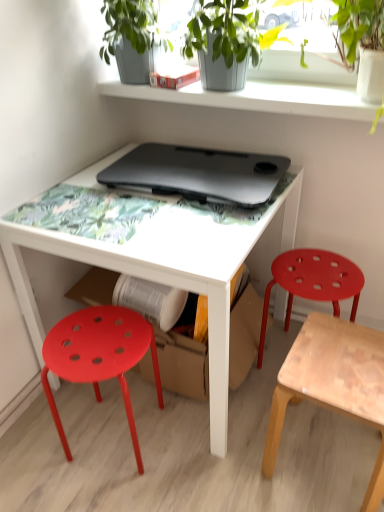
Describe the element at coordinates (227, 41) in the screenshot. I see `green matte plant at upper center` at that location.

The width and height of the screenshot is (384, 512). I want to click on light brown wooden stool at lower right, which appears as the second stool when viewed from the right, so click(x=333, y=384).

What do you see at coordinates (99, 357) in the screenshot? I see `matte plastic stool at lower left, which ranks as the 3th stool in right-to-left order` at bounding box center [99, 357].

This screenshot has height=512, width=384. I want to click on white glossy table at center, so click(164, 273).

The width and height of the screenshot is (384, 512). Describe the element at coordinates (198, 174) in the screenshot. I see `black matte laptop at center` at that location.

You are a GUI agent. You are given a task and a screenshot of the screen. Output one action in this format:
    pyautogui.click(x=<x>, y=<y>)
    Task: Click on the matte plastic stool at right, the 1th stool positioned from the right
    This screenshot has width=384, height=512.
    Given the screenshot: What is the action you would take?
    pyautogui.click(x=312, y=283)

What are the coordinates of `green matte plant at upper center` in the screenshot? It's located at (227, 41).

From a real-world perspective, does green matte plant at upper center sit lower than black matte laptop at center?

No, from a real-world perspective, green matte plant at upper center is not beneath black matte laptop at center.

Considering the relative positions of green matte plant at upper center and black matte laptop at center in the image provided, is green matte plant at upper center to the right of black matte laptop at center from the viewer's perspective?

Yes.

From the image's perspective, which is above, green matte plant at upper center or black matte laptop at center?

green matte plant at upper center, from the image's perspective.

Considering the sizes of objects matte plastic stool at right, which is the 3th stool from left to right, and green matte plant at upper center in the image provided, who is thinner, matte plastic stool at right, which is the 3th stool from left to right, or green matte plant at upper center?

matte plastic stool at right, which is the 3th stool from left to right, is thinner.

From the green matte plant at upper center, count 2nd stool to the right and point to it. Please provide its 2D coordinates.

[(312, 283)]

Is matte plastic stool at right, which is the 3th stool from left to right, smaller than green matte plant at upper center?

No, matte plastic stool at right, which is the 3th stool from left to right, is not smaller than green matte plant at upper center.

From a real-world perspective, is matte plastic stool at right, the 1th stool positioned from the right, on green matte plant at upper center?

No, from a real-world perspective, matte plastic stool at right, the 1th stool positioned from the right, is not above green matte plant at upper center.

Which of these two, matte plastic stool at lower left, which ranks as the 3th stool in right-to-left order, or matte plastic stool at right, which is the 3th stool from left to right, is wider?

matte plastic stool at lower left, which ranks as the 3th stool in right-to-left order, is wider.

From a real-world perspective, is matte plastic stool at lower left, the 1th stool from the left, physically located above or below matte plastic stool at right, the 1th stool positioned from the right?

matte plastic stool at lower left, the 1th stool from the left, is above matte plastic stool at right, the 1th stool positioned from the right.

Measure the distance between matte plastic stool at lower left, the 1th stool from the left, and matte plastic stool at right, the 1th stool positioned from the right.

matte plastic stool at lower left, the 1th stool from the left, and matte plastic stool at right, the 1th stool positioned from the right, are 24.83 inches apart from each other.

Locate an element on the screen. The image size is (384, 512). the 1st stool positioned below the matte plastic stool at lower left, the 1th stool from the left (from a real-world perspective) is located at coordinates (312, 283).

From the image's perspective, is green matte plant at upper center positioned above or below white glossy table at center?

green matte plant at upper center is situated higher than white glossy table at center in the image.

Could you tell me if green matte plant at upper center is facing white glossy table at center?

No, green matte plant at upper center is not facing towards white glossy table at center.

In the scene shown: Which is behind, green matte plant at upper center or white glossy table at center?

green matte plant at upper center is behind.

Is point (211, 7) in front of point (230, 246)?

No, (211, 7) is behind (230, 246).

Is point (348, 355) closer to viewer compared to point (70, 180)?

Yes, it is in front of point (70, 180).

Are light brown wooden stool at lower right, marked as the 2th stool in a left-to-right arrangement, and white glossy table at center far apart?

light brown wooden stool at lower right, marked as the 2th stool in a left-to-right arrangement, is actually quite close to white glossy table at center.

At what (x,y) coordinates should I click in order to perform the action: click on the 1st stool to the right of the white glossy table at center, starting your count from the anchor. Please return your answer as a coordinate pair (x, y). The height and width of the screenshot is (512, 384). Looking at the image, I should click on (333, 384).

Does smooth gray concrete shelf at upper center turn towards matte plastic stool at lower left, the 1th stool from the left?

No, smooth gray concrete shelf at upper center is not turned towards matte plastic stool at lower left, the 1th stool from the left.

How many degrees apart are the facing directions of smooth gray concrete shelf at upper center and matte plastic stool at lower left, the 1th stool from the left?

The facing directions of smooth gray concrete shelf at upper center and matte plastic stool at lower left, the 1th stool from the left, are 179 degrees apart.

Considering the relative positions of smooth gray concrete shelf at upper center and matte plastic stool at lower left, which ranks as the 3th stool in right-to-left order, in the image provided, is smooth gray concrete shelf at upper center behind matte plastic stool at lower left, which ranks as the 3th stool in right-to-left order,?

Yes, the depth of smooth gray concrete shelf at upper center is greater than that of matte plastic stool at lower left, which ranks as the 3th stool in right-to-left order.

Which is in front, point (229, 105) or point (137, 333)?

The point (137, 333) is more forward.

Which object is closer to the camera, smooth gray concrete shelf at upper center or white glossy table at center?

white glossy table at center is closer to the camera.

Are smooth gray concrete shelf at upper center and white glossy table at center far apart?

No, smooth gray concrete shelf at upper center is not far away from white glossy table at center.

Measure the distance between smooth gray concrete shelf at upper center and white glossy table at center.

smooth gray concrete shelf at upper center and white glossy table at center are 21.71 inches apart from each other.

Considering the relative positions of smooth gray concrete shelf at upper center and white glossy table at center in the image provided, is smooth gray concrete shelf at upper center to the left of white glossy table at center from the viewer's perspective?

No.

Locate an element on the screen. houseplant on the right of black matte laptop at center is located at coordinates (227, 41).

Locate an element on the screen. This screenshot has height=512, width=384. houseplant that appears on the left of matte plastic stool at right, which is the 3th stool from left to right is located at coordinates (227, 41).

When comparing their distances from black matte laptop at center, does matte plastic stool at right, the 1th stool positioned from the right, or matte plastic stool at lower left, which ranks as the 3th stool in right-to-left order, seem further?

Among the two, matte plastic stool at lower left, which ranks as the 3th stool in right-to-left order, is located further to black matte laptop at center.

Which object lies nearer to the anchor point smooth gray concrete shelf at upper center, matte plastic stool at lower left, which ranks as the 3th stool in right-to-left order, or black matte laptop at center?

black matte laptop at center is closer to smooth gray concrete shelf at upper center.

Which object lies further to the anchor point matte plastic stool at right, the 1th stool positioned from the right, green matte plant at upper center or white glossy table at center?

Among the two, green matte plant at upper center is located further to matte plastic stool at right, the 1th stool positioned from the right.

Estimate the real-world distances between objects in this image. Which object is further from matte plastic stool at lower left, the 1th stool from the left, smooth gray concrete shelf at upper center or white glossy table at center?

The object further to matte plastic stool at lower left, the 1th stool from the left, is smooth gray concrete shelf at upper center.

Which object lies nearer to the anchor point light brown wooden stool at lower right, which appears as the second stool when viewed from the right, white glossy table at center or matte plastic stool at right, the 1th stool positioned from the right?

matte plastic stool at right, the 1th stool positioned from the right, is positioned closer to the anchor light brown wooden stool at lower right, which appears as the second stool when viewed from the right.

Based on their spatial positions, is green matte plant at upper center or matte plastic stool at lower left, which ranks as the 3th stool in right-to-left order, further from matte plastic stool at right, the 1th stool positioned from the right?

Based on the image, green matte plant at upper center appears to be further to matte plastic stool at right, the 1th stool positioned from the right.

Based on their spatial positions, is white glossy table at center or green matte plant at upper center closer to black matte laptop at center?

white glossy table at center lies closer to black matte laptop at center than the other object.

Which object lies further to the anchor point black matte laptop at center, white glossy table at center or matte plastic stool at lower left, the 1th stool from the left?

matte plastic stool at lower left, the 1th stool from the left.

At what (x,y) coordinates should I click in order to perform the action: click on laptop between smooth gray concrete shelf at upper center and light brown wooden stool at lower right, marked as the 2th stool in a left-to-right arrangement, in the vertical direction. Please return your answer as a coordinate pair (x, y). This screenshot has width=384, height=512. Looking at the image, I should click on (198, 174).

Image resolution: width=384 pixels, height=512 pixels. Find the location of `table between green matte plant at upper center and matte plastic stool at lower left, the 1th stool from the left, in the vertical direction`. table between green matte plant at upper center and matte plastic stool at lower left, the 1th stool from the left, in the vertical direction is located at coordinates (164, 273).

The width and height of the screenshot is (384, 512). What are the coordinates of `shelf between green matte plant at upper center and white glossy table at center in the up-down direction` in the screenshot? It's located at (257, 98).

Locate an element on the screen. stool between green matte plant at upper center and matte plastic stool at lower left, which ranks as the 3th stool in right-to-left order, in the up-down direction is located at coordinates (312, 283).